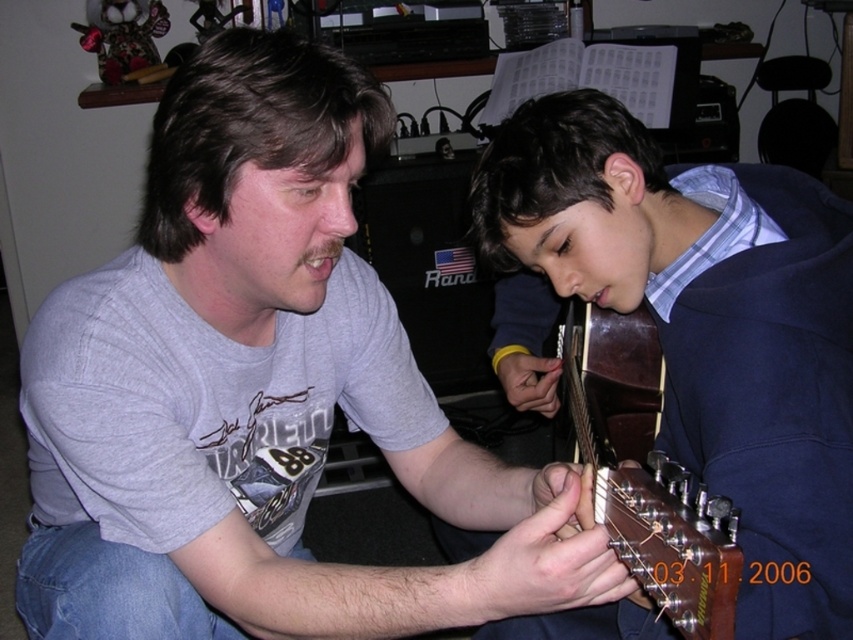
Between dark blue sweater at center and brown glossy guitar at lower center, which one has more height?

Standing taller between the two is dark blue sweater at center.

Can you confirm if dark blue sweater at center is positioned to the right of brown glossy guitar at lower center?

Incorrect, dark blue sweater at center is not on the right side of brown glossy guitar at lower center.

Where is `dark blue sweater at center`? The height and width of the screenshot is (640, 853). dark blue sweater at center is located at coordinates (695, 323).

Is point (161, 371) less distant than point (708, 627)?

No, it is not.

Between gray matte t-shirt at center and brown glossy guitar at lower center, which one is positioned higher?

brown glossy guitar at lower center

Find the location of a particular element. gray matte t-shirt at center is located at coordinates (258, 392).

Where is `gray matte t-shirt at center`? The width and height of the screenshot is (853, 640). gray matte t-shirt at center is located at coordinates (258, 392).

Where is `gray matte t-shirt at center`? Image resolution: width=853 pixels, height=640 pixels. gray matte t-shirt at center is located at coordinates (258, 392).

Who is higher up, gray matte t-shirt at center or dark blue sweater at center?

dark blue sweater at center is higher up.

Is point (257, 552) positioned before point (589, 240)?

Yes, point (257, 552) is closer to viewer.

Find the location of a particular element. The width and height of the screenshot is (853, 640). gray matte t-shirt at center is located at coordinates (258, 392).